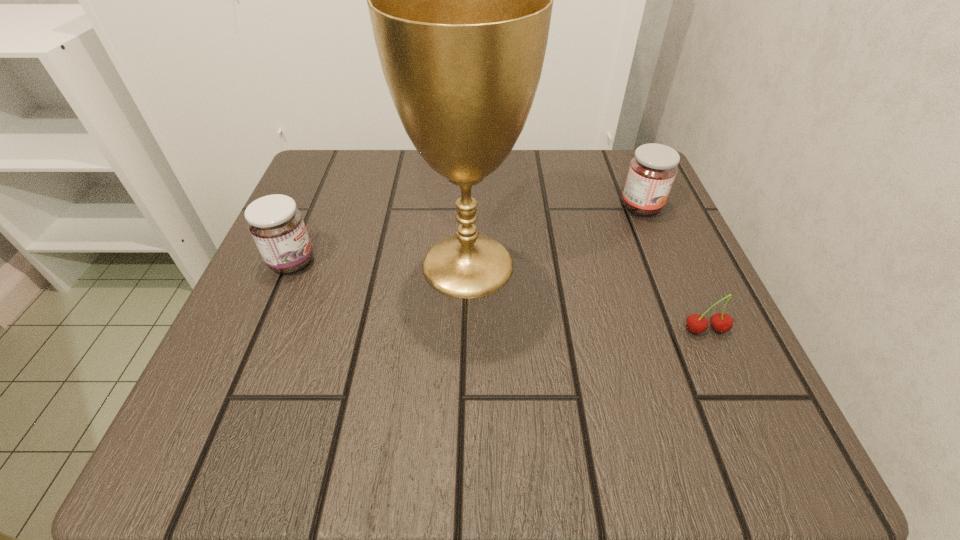
Identify the location of free space at the right edge. This screenshot has width=960, height=540. (660, 340).

Where is `vacant space at the far left corner of the desktop`? This screenshot has width=960, height=540. vacant space at the far left corner of the desktop is located at coordinates (366, 187).

This screenshot has height=540, width=960. Identify the location of vacant space at the far right corner of the desktop. coord(597,211).

Image resolution: width=960 pixels, height=540 pixels. Identify the location of vacant space that is in between the nearest object and the farthest object. (673, 269).

Identify the location of free space between the third object from right to left and the shortest object. (587, 298).

The height and width of the screenshot is (540, 960). Identify the location of free space between the leftmost object and the tallest object. (380, 263).

Where is `free space between the cherry and the farthest object`? The height and width of the screenshot is (540, 960). free space between the cherry and the farthest object is located at coordinates (673, 269).

Locate an element on the screen. The height and width of the screenshot is (540, 960). free spot between the farthest object and the shortest object is located at coordinates (673, 269).

At what (x,y) coordinates should I click in order to perform the action: click on vacant area that lies between the cherry and the farthest object. Please return your answer as a coordinate pair (x, y). Image resolution: width=960 pixels, height=540 pixels. Looking at the image, I should click on (673, 269).

The height and width of the screenshot is (540, 960). Identify the location of vacant space that's between the tallest object and the left jam. (380, 263).